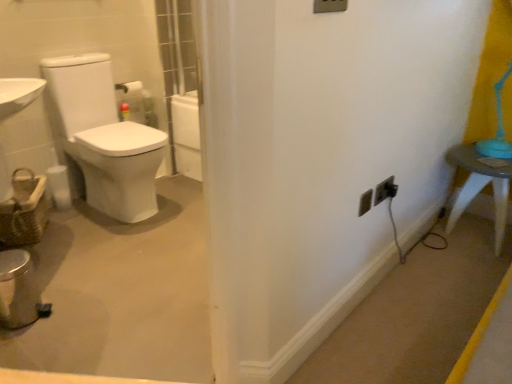
Question: Considering the positions of white glossy toilet at left and white plastic outlet at lower right, the first electric outlet when ordered from left to right, in the image, is white glossy toilet at left wider or thinner than white plastic outlet at lower right, the first electric outlet when ordered from left to right,?

Choices:
 (A) wide
 (B) thin

Answer: (A)

Question: Does point (151, 210) appear closer or farther from the camera than point (359, 205)?

Choices:
 (A) closer
 (B) farther

Answer: (B)

Question: Based on their relative distances, which object is farther from the white plastic table at right?

Choices:
 (A) white plastic outlet at lower right, the first electric outlet when ordered from left to right
 (B) white plastic light switch at upper center
 (C) black plastic outlet at lower right, which is counted as the 1th electric outlet, starting from the right
 (D) black plastic electrical outlet at lower right, which appears as the 2th electric outlet when viewed from the right
 (E) white glossy toilet at left

Answer: (E)

Question: Considering the real-world distances, which object is closest to the white plastic outlet at lower right, which appears as the third electric outlet when viewed from the right?

Choices:
 (A) white glossy toilet at left
 (B) black plastic electrical outlet at lower right, arranged as the 2th electric outlet when viewed from the left
 (C) black plastic outlet at lower right, placed as the 3th electric outlet when sorted from left to right
 (D) white plastic light switch at upper center
 (E) woven brown basket at left

Answer: (B)